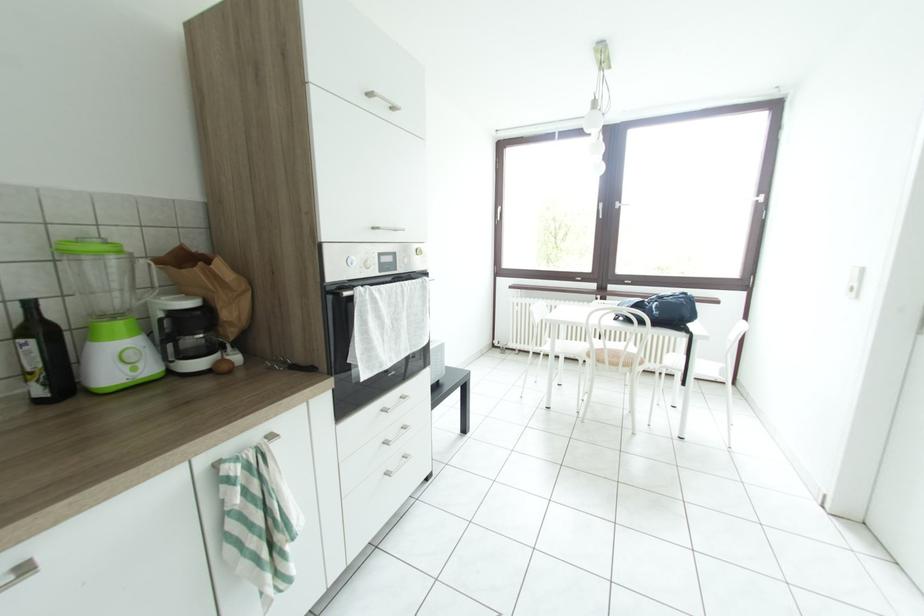
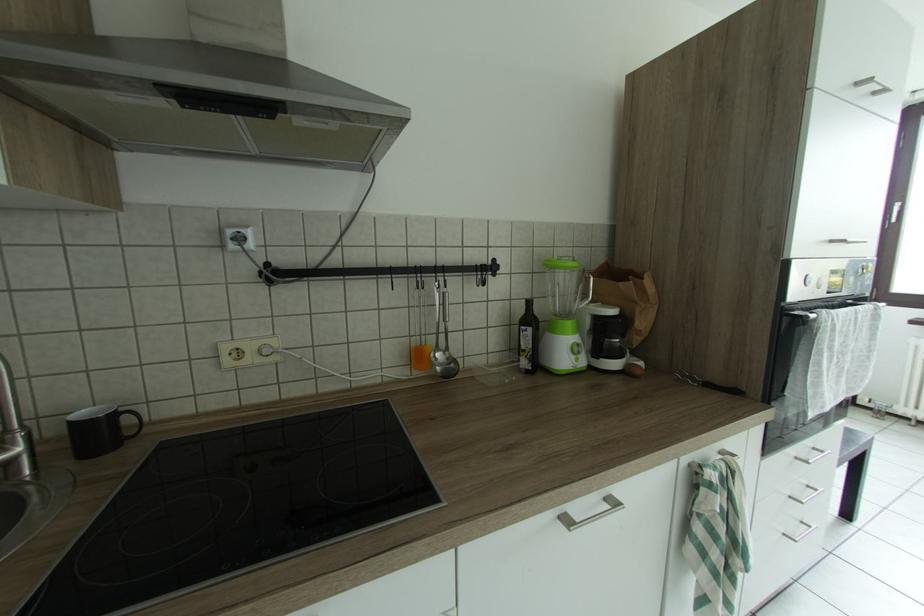
Question: The camera is either moving clockwise (left) or counter-clockwise (right) around the object. The first image is from the beginning of the video and the second image is from the end. Is the camera moving left or right when shooting the video?

Choices:
 (A) Left
 (B) Right

Answer: (B)